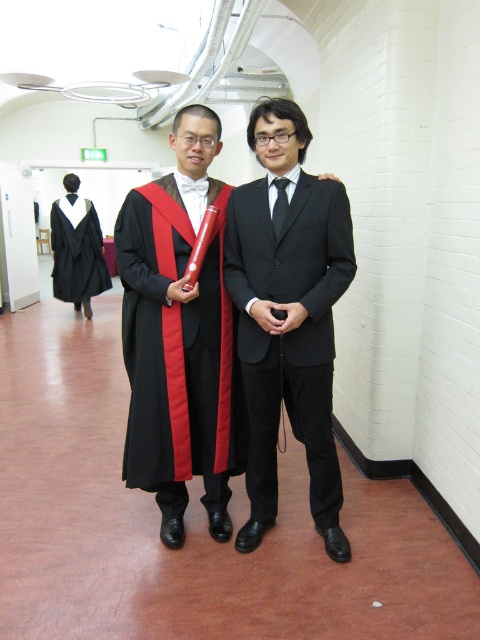
Is black satin suit at center taller than black matte graduation gown at left?

Correct, black satin suit at center is much taller as black matte graduation gown at left.

Looking at this image, can you confirm if black satin suit at center is smaller than black matte graduation gown at left?

No, black satin suit at center is not smaller than black matte graduation gown at left.

Which is behind, point (268, 428) or point (64, 250)?

The point (64, 250) is behind.

Locate an element on the screen. black satin suit at center is located at coordinates (288, 314).

Is black satin suit at center to the left of matte black graduation gown at center from the viewer's perspective?

Incorrect, black satin suit at center is not on the left side of matte black graduation gown at center.

Is black satin suit at center closer to the viewer compared to matte black graduation gown at center?

Yes, black satin suit at center is in front of matte black graduation gown at center.

The width and height of the screenshot is (480, 640). Find the location of `black satin suit at center`. black satin suit at center is located at coordinates (288, 314).

Which is below, matte black graduation gown at center or black matte graduation gown at left?

Positioned lower is matte black graduation gown at center.

The width and height of the screenshot is (480, 640). Describe the element at coordinates (176, 348) in the screenshot. I see `matte black graduation gown at center` at that location.

Which is in front, point (187, 476) or point (104, 280)?

Positioned in front is point (187, 476).

Identify the location of matte black graduation gown at center. This screenshot has width=480, height=640. (176, 348).